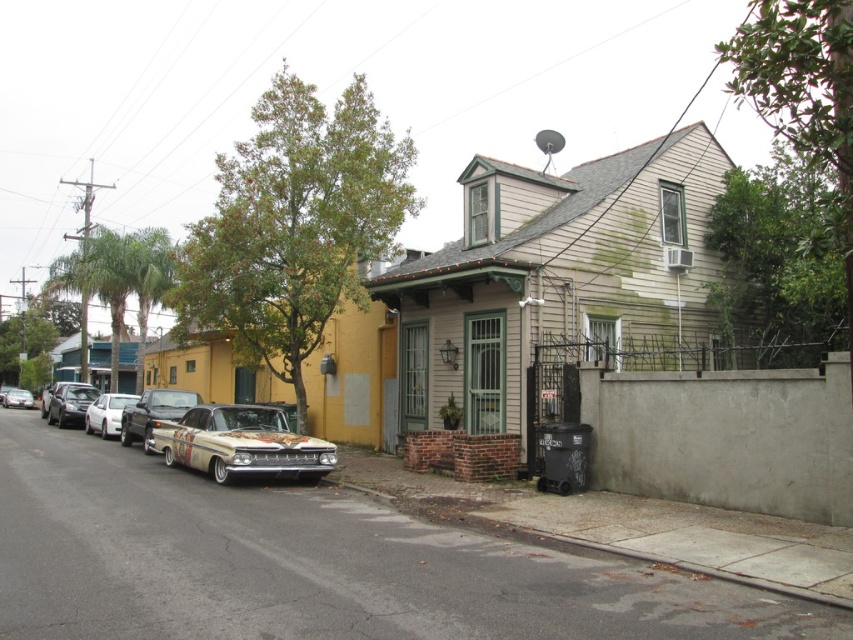
Question: Does painted wood car at center have a greater width compared to shiny silver car at left?

Choices:
 (A) yes
 (B) no

Answer: (B)

Question: Among these points, which one is nearest to the camera?

Choices:
 (A) (323, 458)
 (B) (7, 403)

Answer: (A)

Question: Is shiny chrome car at center closer to camera compared to white matte car at left?

Choices:
 (A) yes
 (B) no

Answer: (A)

Question: Which point is closer to the camera?

Choices:
 (A) gray concrete curb at lower right
 (B) white matte car at left
 (C) shiny chrome car at center

Answer: (A)

Question: Which of the following is the farthest from the observer?

Choices:
 (A) (90, 420)
 (B) (242, 445)
 (C) (140, 408)

Answer: (A)

Question: Does shiny silver car at left appear on the right side of shiny silver car at center?

Choices:
 (A) no
 (B) yes

Answer: (B)